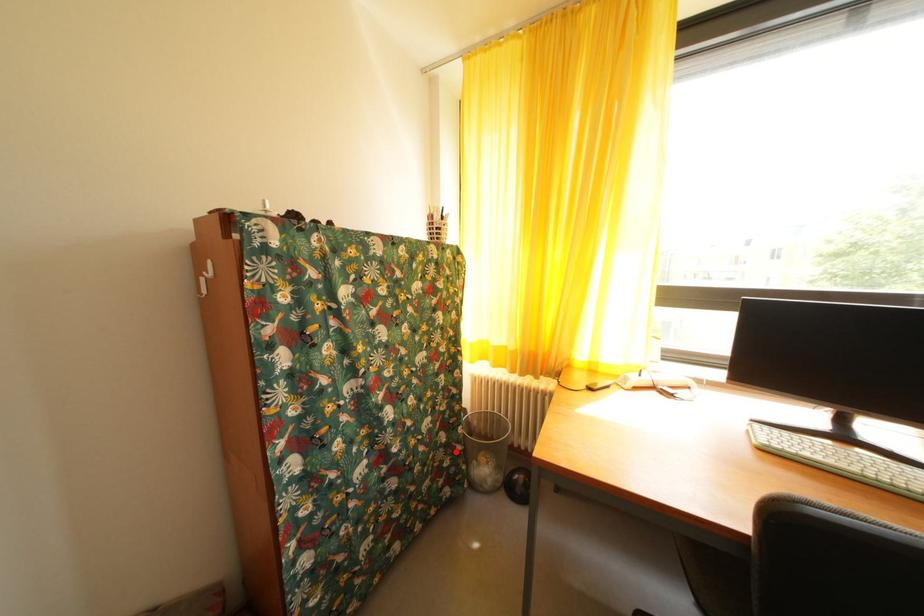
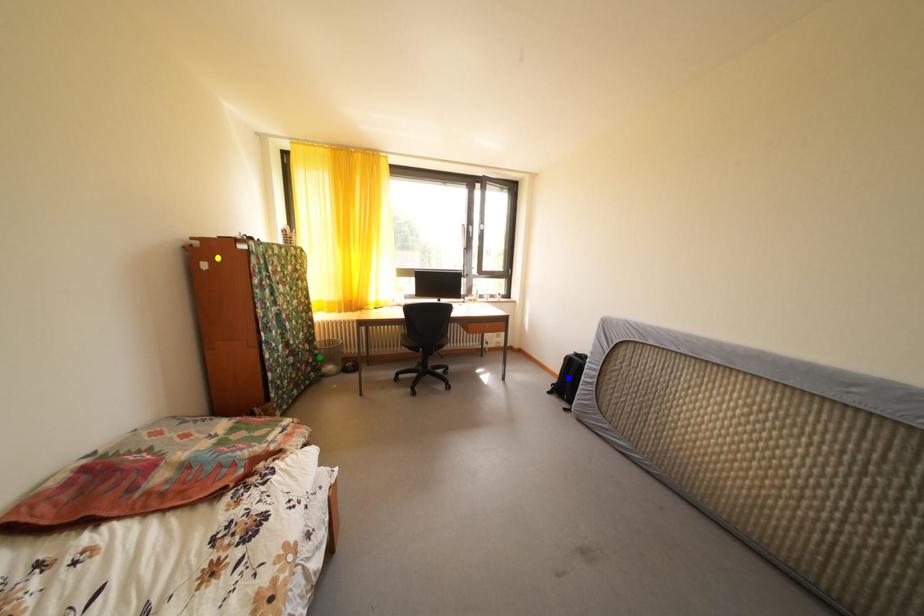
Question: I am providing you with two images of the same scene from different viewpoints. A red point is marked on the first image. You are given multiple points on the second image. Which spot in image 2 lines up with the point in image 1?

Choices:
 (A) green point
 (B) blue point
 (C) yellow point

Answer: (A)